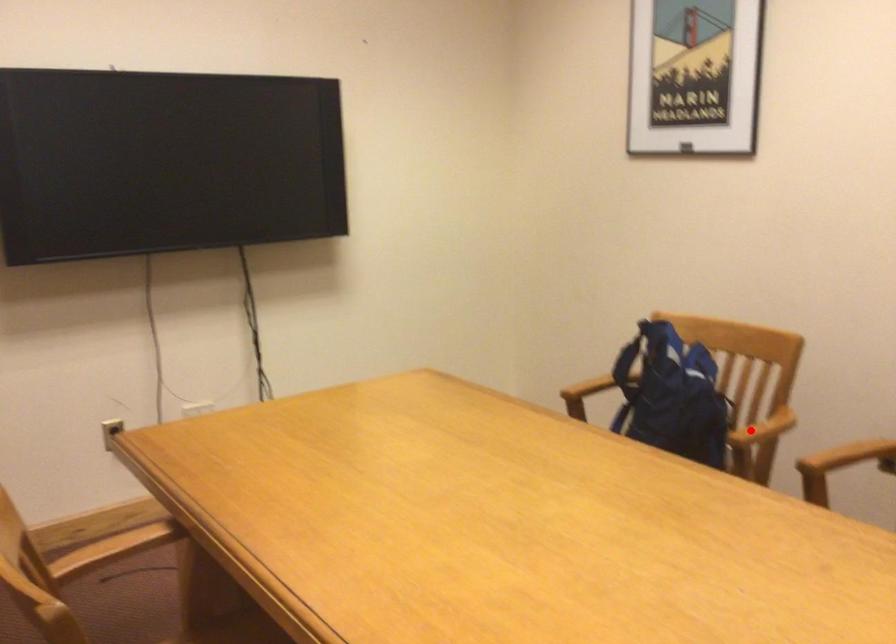
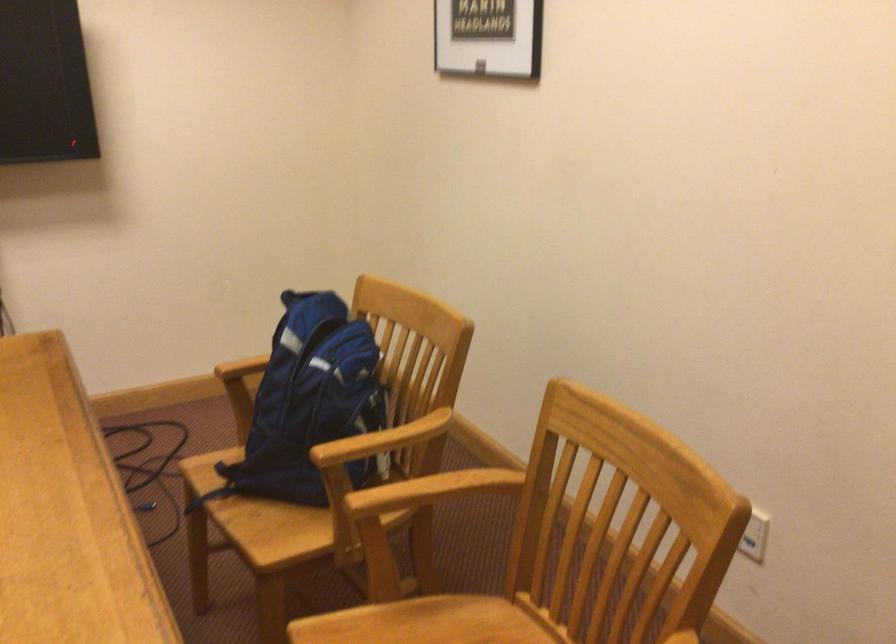
Question: A red point is marked in image1. In image2, is the corresponding 3D point closer to the camera or farther? Reply with the corresponding letter.

Choices:
 (A) The corresponding 3D point is closer.
 (B) The corresponding 3D point is farther.

Answer: (A)